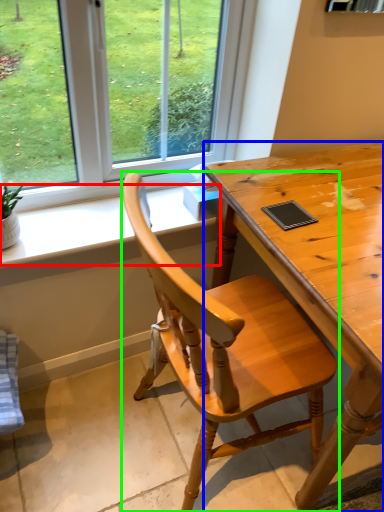
Question: Based on their relative distances, which object is nearer to window sill (highlighted by a red box)? Choose from desk (highlighted by a blue box) and chair (highlighted by a green box).

Choices:
 (A) desk
 (B) chair

Answer: (A)